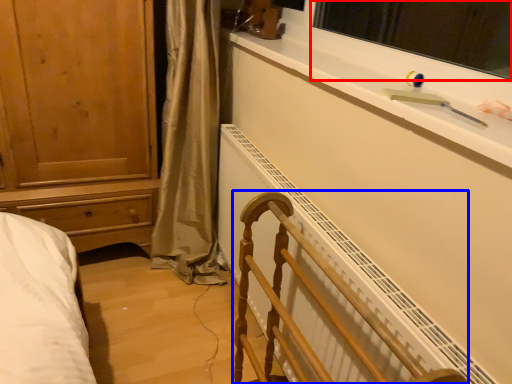
Question: Among these objects, which one is nearest to the camera, window screen (highlighted by a red box) or furniture (highlighted by a blue box)?

Choices:
 (A) window screen
 (B) furniture

Answer: (B)